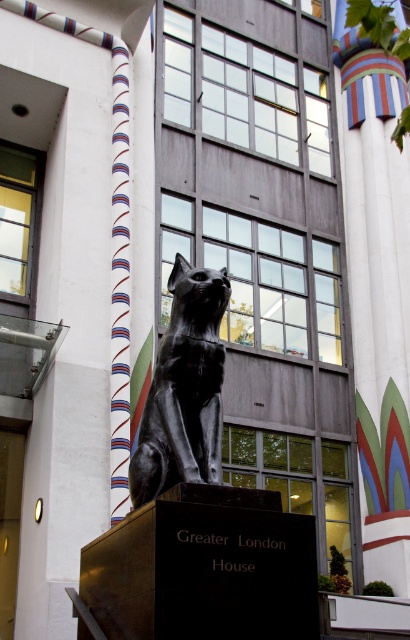
Question: Which point is farther from the camera taking this photo?

Choices:
 (A) (218, 310)
 (B) (405, 195)

Answer: (B)

Question: Can you confirm if white striped pillar at center is thinner than black polished stone cat at center?

Choices:
 (A) no
 (B) yes

Answer: (A)

Question: Can you confirm if white striped pillar at center is smaller than black polished stone cat at center?

Choices:
 (A) no
 (B) yes

Answer: (A)

Question: Which point is closer to the camera?

Choices:
 (A) white striped pillar at center
 (B) black polished stone cat at center

Answer: (B)

Question: Considering the relative positions of white striped pillar at center and black polished stone cat at center in the image provided, where is white striped pillar at center located with respect to black polished stone cat at center?

Choices:
 (A) above
 (B) below

Answer: (A)